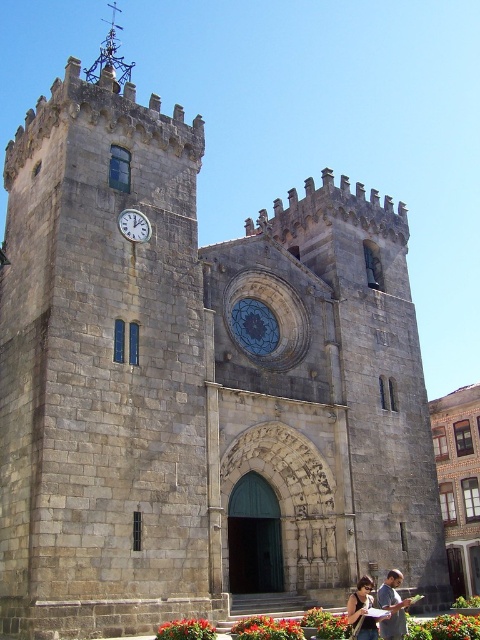
Is point (376, 637) in front of point (140, 224)?

That is True.

Describe the element at coordinates (381, 608) in the screenshot. I see `matte gray stone couple at center` at that location.

You are a GUI agent. You are given a task and a screenshot of the screen. Output one action in this format:
    pyautogui.click(x=<x>, y=<y>)
    Task: Click on the matte gray stone couple at center
    
    Given the screenshot: What is the action you would take?
    pyautogui.click(x=381, y=608)